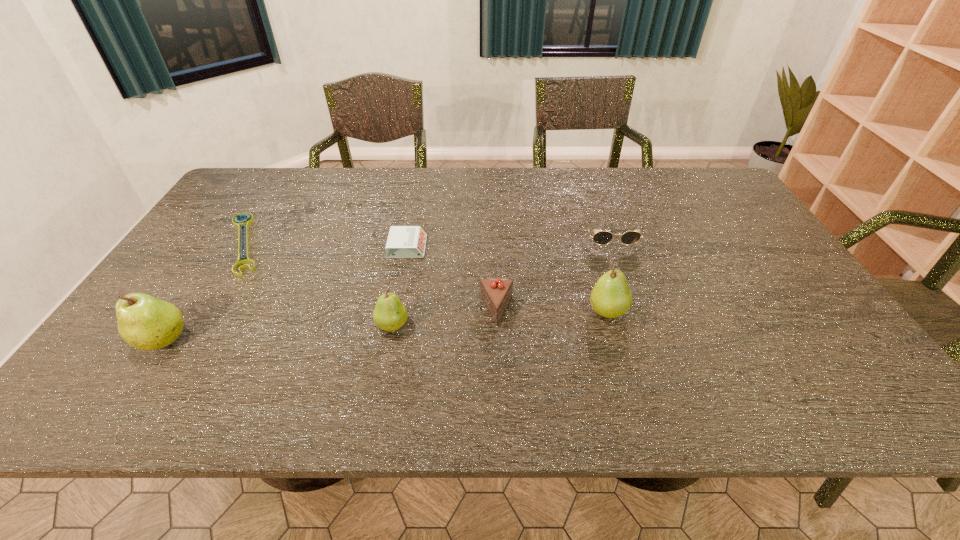
The pears are evenly distributed in the image. To maintain this, where would you place another pear on the right? Please point to a free space. Please provide its 2D coordinates. Your answer should be formatted as a tuple, i.e. [(x, y)], where the tuple contains the x and y coordinates of a point satisfying the conditions above.

[(809, 298)]